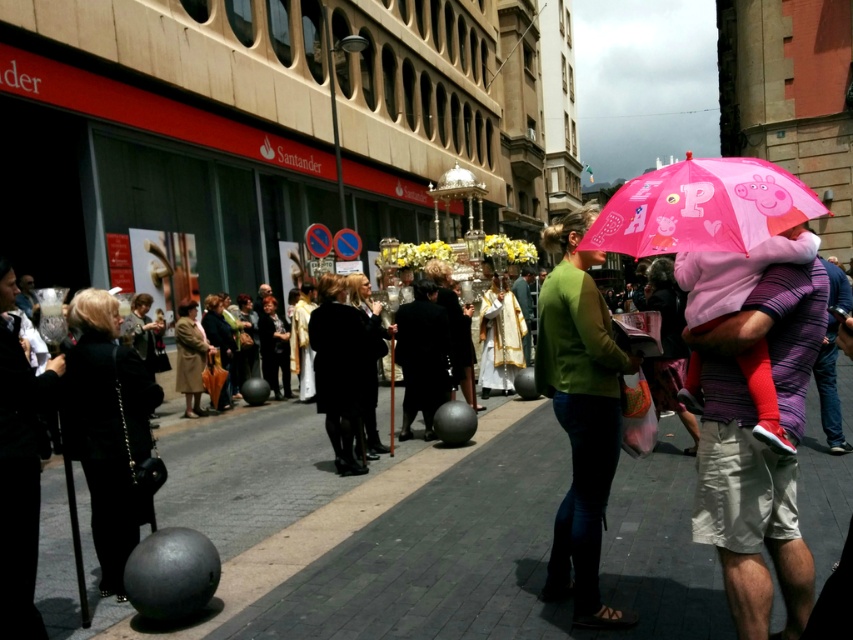
Question: Which of the following is the closest to the observer?

Choices:
 (A) (67, 355)
 (B) (7, 419)

Answer: (B)

Question: Is pink fabric umbrella at upper right thinner than black fabric purse at left?

Choices:
 (A) no
 (B) yes

Answer: (A)

Question: Does pink fabric umbrella at upper right appear over black matte coat at center?

Choices:
 (A) no
 (B) yes

Answer: (B)

Question: Which object is farther from the camera taking this photo?

Choices:
 (A) green matte sweater at center
 (B) pink fabric umbrella at right
 (C) black fabric purse at left

Answer: (A)

Question: Can you confirm if black leather jacket at lower left is positioned to the left of black fabric purse at left?

Choices:
 (A) no
 (B) yes

Answer: (B)

Question: Which point is farther from the camera taking this photo?

Choices:
 (A) (434, 300)
 (B) (558, 548)
 (C) (734, 353)
 (D) (91, 428)

Answer: (A)